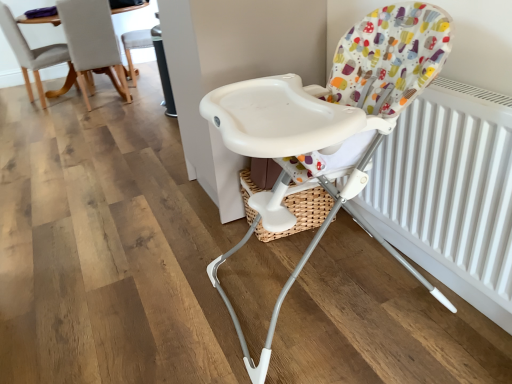
Question: From a real-world perspective, is white matte radiator at right above or below white plastic highchair at center, which is counted as the third chair, starting from the back?

Choices:
 (A) above
 (B) below

Answer: (B)

Question: From the image's perspective, relative to white plastic highchair at center, which is counted as the third chair, starting from the back, is white matte radiator at right above or below?

Choices:
 (A) above
 (B) below

Answer: (A)

Question: Which object is positioned closest to the white plastic chair at upper center, which ranks as the 2th chair in right-to-left order?

Choices:
 (A) light gray fabric chair at upper left, the 2th chair positioned from the front
 (B) white plastic highchair at center, the 3th chair when ordered from left to right
 (C) white matte radiator at right

Answer: (A)

Question: Estimate the real-world distances between objects in this image. Which object is farther from the light gray fabric chair at upper left, which appears as the 2th chair when viewed from the back?

Choices:
 (A) white matte radiator at right
 (B) white plastic chair at upper center, which appears as the third chair when viewed from the front
 (C) white plastic highchair at center, which is the 1th chair in front-to-back order

Answer: (A)